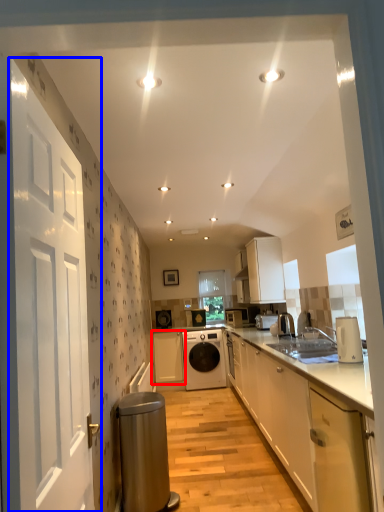
Question: Which object appears closest to the camera in this image, cabinetry (highlighted by a red box) or door (highlighted by a blue box)?

Choices:
 (A) cabinetry
 (B) door

Answer: (B)